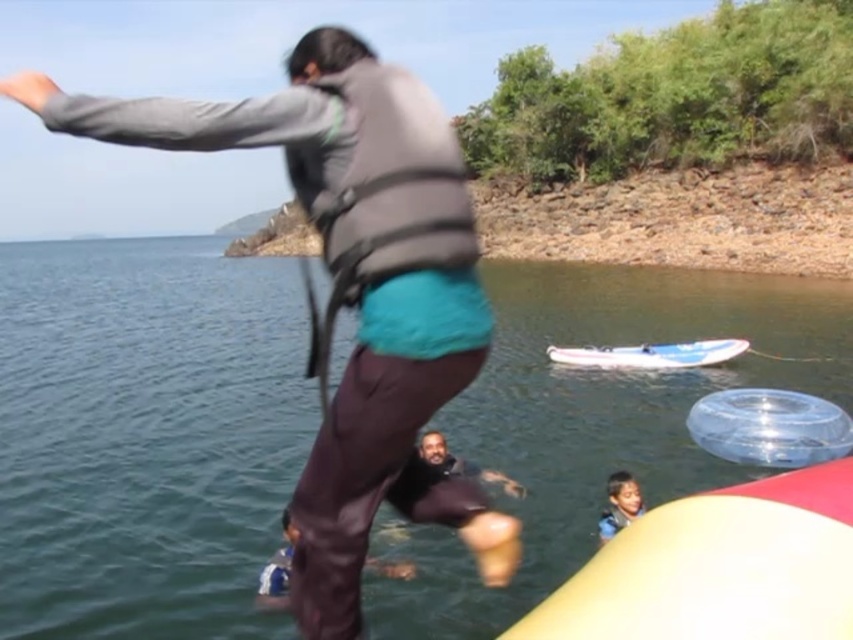
Is matte gray life vest at center above smooth skin child at lower right?

Yes.

Consider the image. Which is more to the right, matte gray life vest at center or smooth skin child at lower right?

Positioned to the right is smooth skin child at lower right.

Image resolution: width=853 pixels, height=640 pixels. I want to click on matte gray life vest at center, so click(x=352, y=291).

Describe the element at coordinates (352, 291) in the screenshot. I see `matte gray life vest at center` at that location.

Between matte gray life vest at center and white plastic boat at center, which one is positioned higher?

white plastic boat at center

Who is more forward, (143, 112) or (596, 364)?

Point (143, 112) is more forward.

Where is `matte gray life vest at center`? The width and height of the screenshot is (853, 640). matte gray life vest at center is located at coordinates (352, 291).

Is point (503, 634) less distant than point (593, 355)?

Yes, point (503, 634) is in front of point (593, 355).

Is yellow rubber boat at lower right below white plastic boat at center?

Correct, yellow rubber boat at lower right is located below white plastic boat at center.

Is point (828, 627) farther from viewer compared to point (613, 365)?

No, (828, 627) is in front of (613, 365).

Locate an element on the screen. The width and height of the screenshot is (853, 640). yellow rubber boat at lower right is located at coordinates (718, 566).